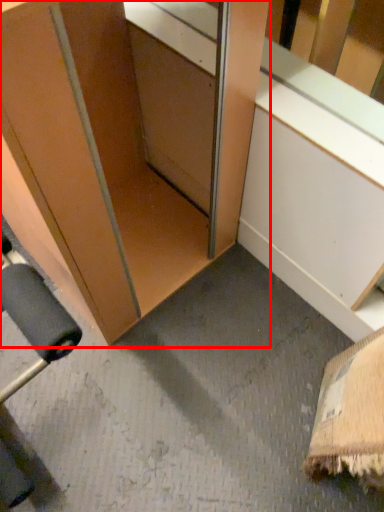
Question: In this image, where is cabinetry (annotated by the red box) located relative to window sill?

Choices:
 (A) right
 (B) left

Answer: (B)